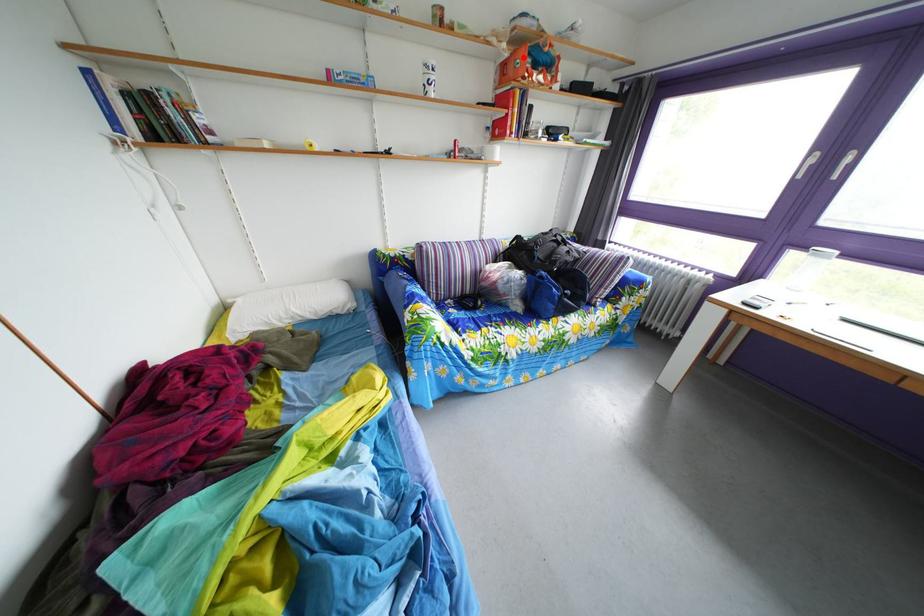
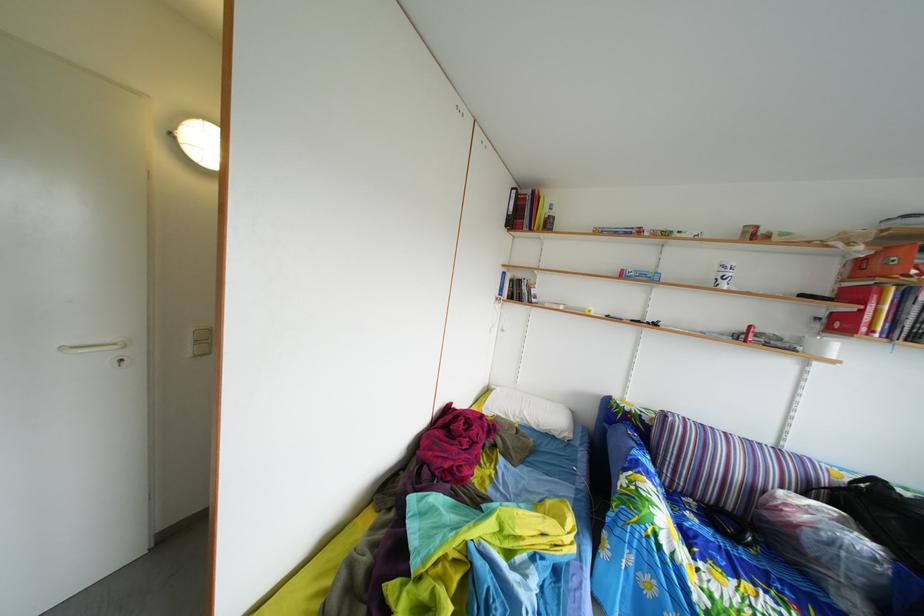
Locate, in the second image, the point that corresponds to the highlighted location in the first image.

(892, 256)